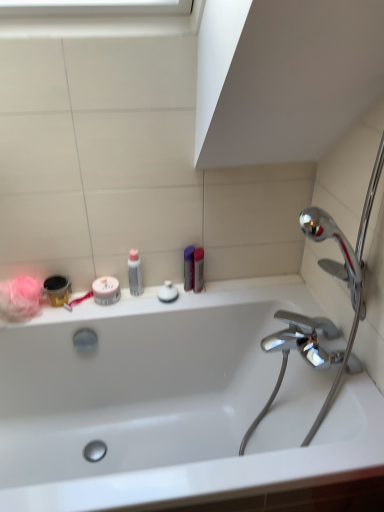
Question: Which direction should I rotate to look at purple plastic container at upper center, which appears as the third toiletry when viewed from the left, — up or down?

Choices:
 (A) down
 (B) up

Answer: (A)

Question: Is white matte jar at center, which ranks as the 2th mouthwash in right-to-left order, not within metallic silver toothbrush at left?

Choices:
 (A) yes
 (B) no

Answer: (A)

Question: Is white matte jar at center, marked as the first mouthwash in a left-to-right arrangement, at the left side of metallic silver toothbrush at left?

Choices:
 (A) no
 (B) yes

Answer: (A)

Question: Is white matte jar at center, marked as the first mouthwash in a left-to-right arrangement, bigger than metallic silver toothbrush at left?

Choices:
 (A) yes
 (B) no

Answer: (A)

Question: Considering the relative sizes of white matte jar at center, marked as the first mouthwash in a left-to-right arrangement, and metallic silver toothbrush at left in the image provided, is white matte jar at center, marked as the first mouthwash in a left-to-right arrangement, thinner than metallic silver toothbrush at left?

Choices:
 (A) yes
 (B) no

Answer: (A)

Question: Is white matte jar at center, which ranks as the 2th mouthwash in right-to-left order, further to the viewer compared to metallic silver toothbrush at left?

Choices:
 (A) no
 (B) yes

Answer: (A)

Question: Does white matte jar at center, marked as the first mouthwash in a left-to-right arrangement, have a greater height compared to metallic silver toothbrush at left?

Choices:
 (A) yes
 (B) no

Answer: (A)

Question: Is white matte jar at center, which ranks as the 2th mouthwash in right-to-left order, inside metallic silver toothbrush at left?

Choices:
 (A) no
 (B) yes

Answer: (A)

Question: From the image's perspective, is metallic silver toothbrush at left on top of white matte jar at center, marked as the first mouthwash in a left-to-right arrangement?

Choices:
 (A) yes
 (B) no

Answer: (B)

Question: Is metallic silver toothbrush at left closer to camera compared to white matte jar at center, which ranks as the 2th mouthwash in right-to-left order?

Choices:
 (A) no
 (B) yes

Answer: (A)

Question: Is metallic silver toothbrush at left in contact with white matte jar at center, marked as the first mouthwash in a left-to-right arrangement?

Choices:
 (A) no
 (B) yes

Answer: (B)

Question: Does metallic silver toothbrush at left appear on the left side of white matte jar at center, which ranks as the 2th mouthwash in right-to-left order?

Choices:
 (A) yes
 (B) no

Answer: (A)

Question: Considering the relative sizes of metallic silver toothbrush at left and white matte jar at center, marked as the first mouthwash in a left-to-right arrangement, in the image provided, is metallic silver toothbrush at left thinner than white matte jar at center, marked as the first mouthwash in a left-to-right arrangement,?

Choices:
 (A) no
 (B) yes

Answer: (A)

Question: From the image's perspective, is white matte jar at center, which ranks as the 2th mouthwash in right-to-left order, below translucent plastic bottle at upper center, which appears as the 3th toiletry when viewed from the right?

Choices:
 (A) yes
 (B) no

Answer: (A)